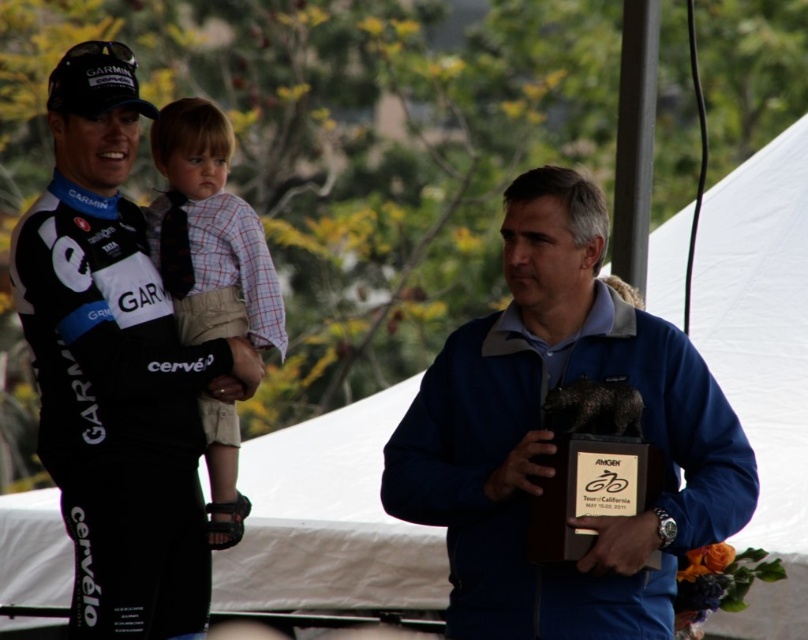
You are a photographer trying to capture a wide shot of both the person in the black cycling outfit on the left and the blue fabric jacket at center. Given that your camera has a maximum focus range of 60 feet, will you be able to capture both subjects in focus?

The two subjects are 61.57 feet apart, which exceeds the camera maximum focus range of 60 feet. Therefore, you won not be able to capture both subjects in focus.

You are organizing a photo shoot and need to ensure that the matte black cycling jersey at center and the plaid shirt at center are visible in the frame. Given their sizes, which one might require more space in the composition?

The matte black cycling jersey at center is larger in size than the plaid shirt at center, so it would require more space in the composition to ensure visibility.

You are a photographer positioned at the center of the stage. You need to capture a photo that includes both the blue fabric jacket at center and the matte black cycling jersey at center. What is the minimum distance you need to move backward to ensure both objects are in frame?

The blue fabric jacket at center is 12.40 feet from the matte black cycling jersey at center. To include both in the frame, you need to move backward at least 12.40 feet to ensure both are visible.